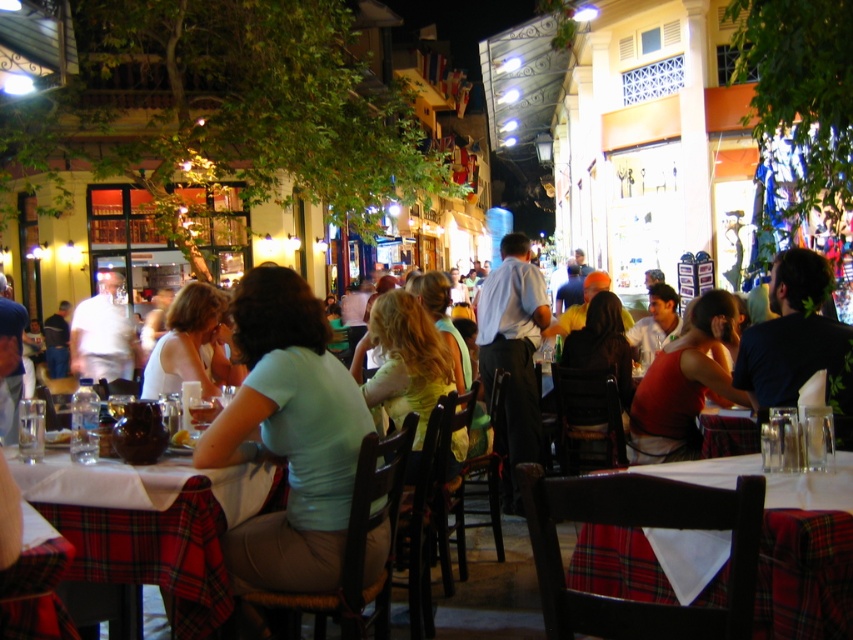
Question: Which of the following is the farthest from the observer?

Choices:
 (A) (699, 317)
 (B) (639, 564)

Answer: (A)

Question: Which of the following is the closest to the observer?

Choices:
 (A) (x=119, y=531)
 (B) (x=851, y=584)

Answer: (B)

Question: Does white cloth at center have a larger size compared to plaid fabric tablecloth at center?

Choices:
 (A) yes
 (B) no

Answer: (B)

Question: Which object is the farthest from the light blue shirt at center?

Choices:
 (A) matte red dress at center
 (B) dark blue shirt at right
 (C) plaid fabric tablecloth at center
 (D) white shirt at center

Answer: (D)

Question: Is light blue fabric shirt at center wider than matte red dress at center?

Choices:
 (A) yes
 (B) no

Answer: (B)

Question: Does light blue fabric shirt at center have a larger size compared to plaid fabric tablecloth at center?

Choices:
 (A) no
 (B) yes

Answer: (B)